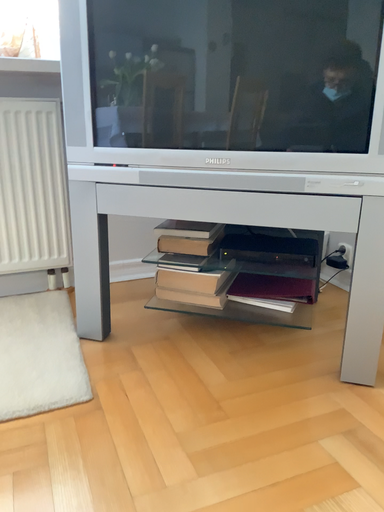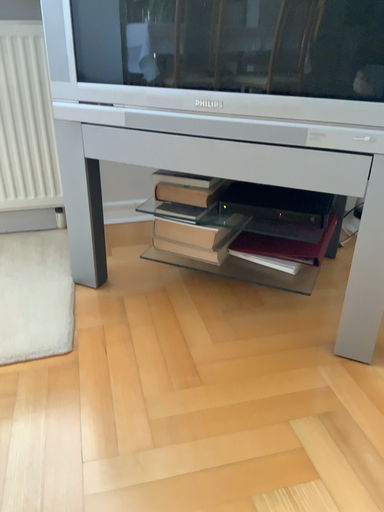
Question: How did the camera likely rotate when shooting the video?

Choices:
 (A) rotated right
 (B) rotated left

Answer: (B)